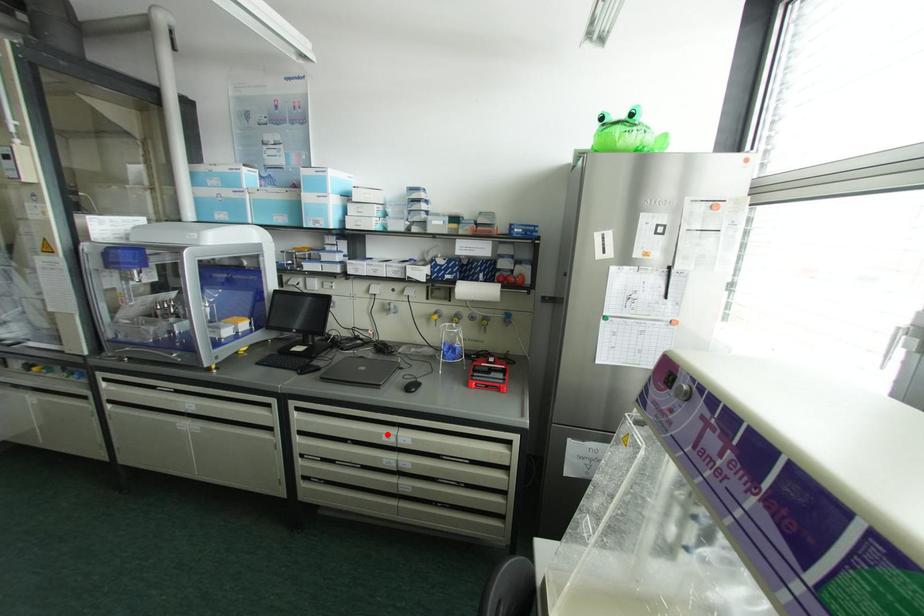
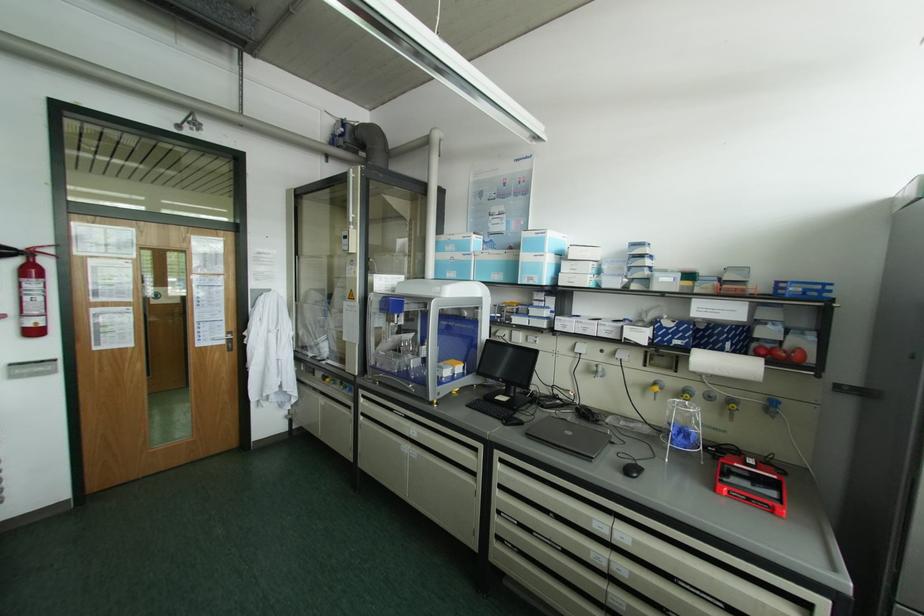
In the second image, find the point that corresponds to the highlighted location in the first image.

(600, 523)